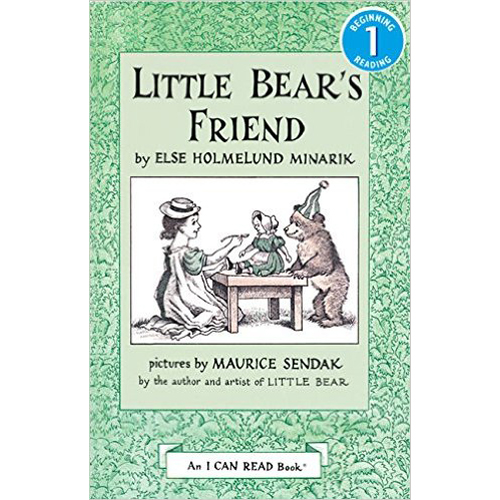
Where is `table`? This screenshot has height=500, width=500. table is located at coordinates (241, 280).